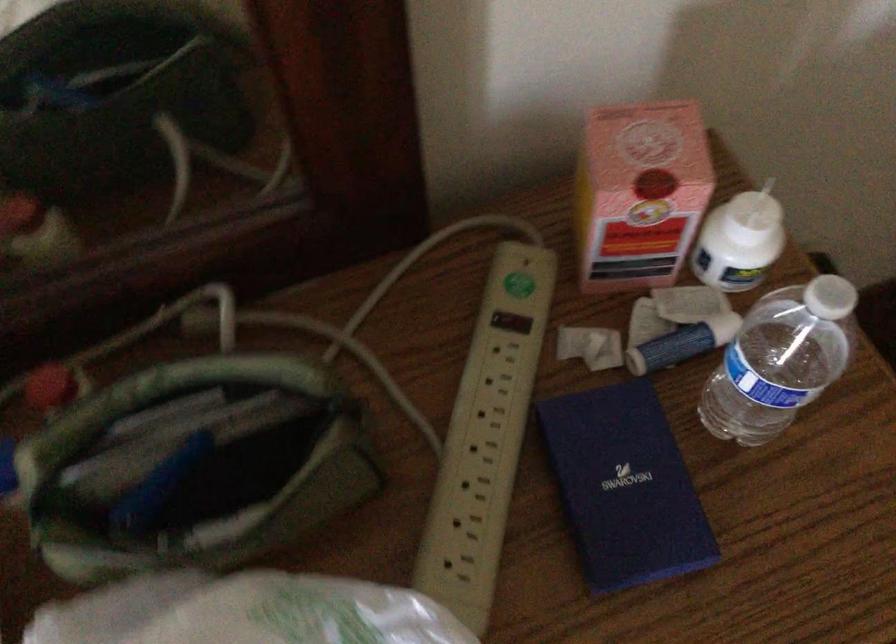
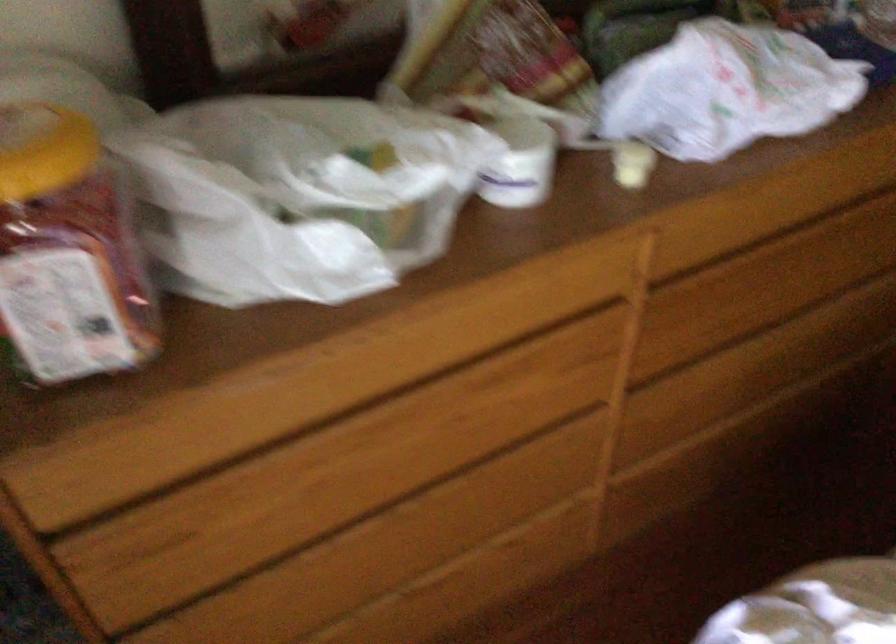
In a continuous first-person perspective shot, in which direction is the camera moving?

The movement direction of the cameraman is left, backward.